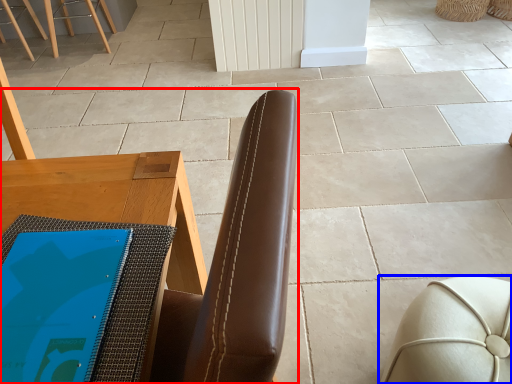
Question: Among these objects, which one is nearest to the camera, chair (highlighted by a red box) or furniture (highlighted by a blue box)?

Choices:
 (A) chair
 (B) furniture

Answer: (A)